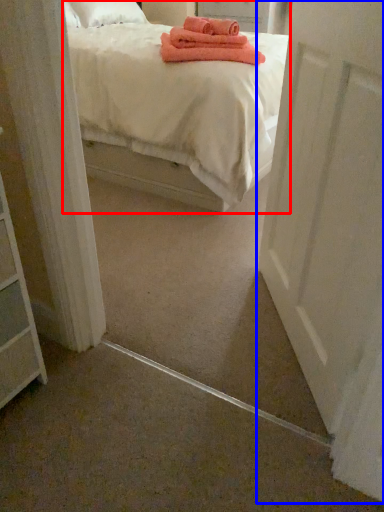
Question: Which object appears farthest to the camera in this image, bed (highlighted by a red box) or door (highlighted by a blue box)?

Choices:
 (A) bed
 (B) door

Answer: (A)